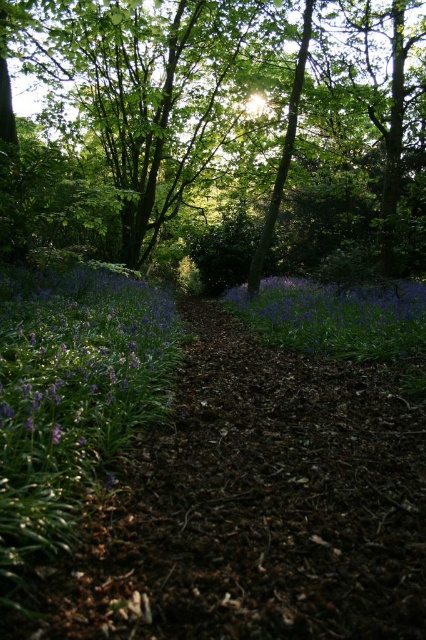
Does green leafy tree at center have a greater height compared to purple matte flowers at lower left?

Yes.

Does green leafy tree at center have a smaller size compared to purple matte flowers at lower left?

No, green leafy tree at center is not smaller than purple matte flowers at lower left.

Does point (310, 17) come farther from viewer compared to point (97, 273)?

That is True.

Locate an element on the screen. The width and height of the screenshot is (426, 640). green leafy tree at center is located at coordinates click(x=219, y=125).

Who is lower down, purple matte flowers at lower left or purple matte flower at center?

purple matte flowers at lower left is lower down.

Can you confirm if purple matte flowers at lower left is bigger than purple matte flower at center?

No, purple matte flowers at lower left is not bigger than purple matte flower at center.

Identify the location of purple matte flowers at lower left. (80, 352).

This screenshot has height=640, width=426. Identify the location of purple matte flowers at lower left. (80, 352).

Is point (137, 161) closer to viewer compared to point (371, 307)?

That is False.

Measure the distance between point (69,67) and camera.

They are 16.84 meters apart.

This screenshot has width=426, height=640. I want to click on green leafy tree at center, so click(x=219, y=125).